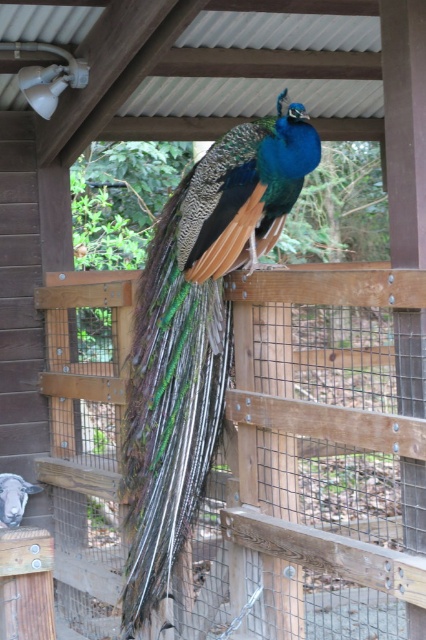
You are a visitor at the zoo and want to take a photo of the shiny iridescent peacock at center through the wooden fence at center. Can you position yourself to the left of the peacock to capture it without the fence blocking the view?

The wooden fence at center is to the right of the shiny iridescent peacock at center, so positioning yourself to the left of the peacock would allow you to take the photo without the fence blocking the view.

You are a visitor at the zoo and want to take a photo of the shiny iridescent peacock at center. However, you notice the wooden fence at center might block your view. Based on their heights, can you see the peacock clearly over the fence?

The wooden fence at center has a lesser height compared to the shiny iridescent peacock at center, so yes, you can see the peacock clearly over the fence since it is taller than the fence.

You are standing in front of the peacock enclosure and want to locate the wooden fence at center. Can you determine its position based on the coordinates provided?

The wooden fence at center is located at the 2D coordinates point (x=313, y=465).